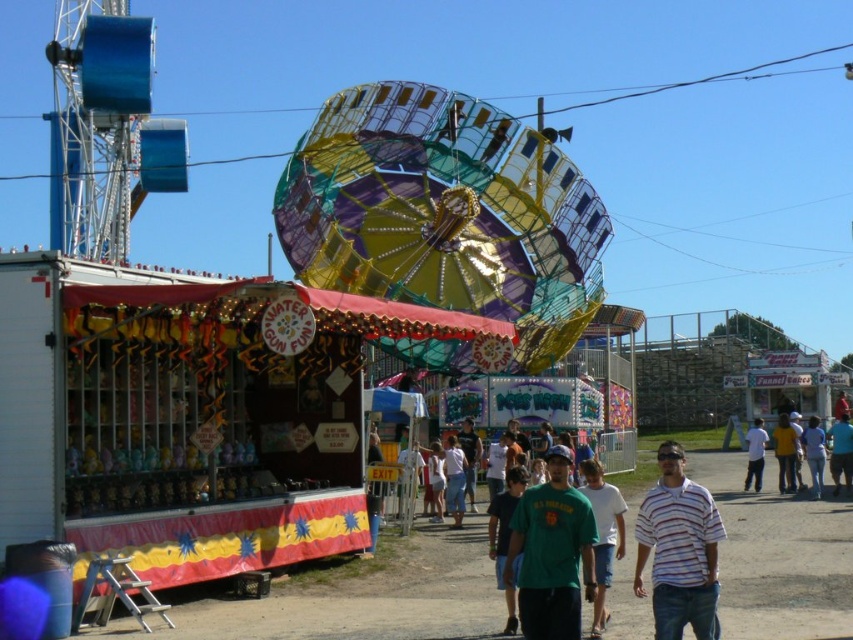
Is green cotton shirt at center further to the viewer compared to white cotton shirt at lower right?

That is False.

Is green cotton shirt at center taller than white cotton shirt at lower right?

Yes, green cotton shirt at center is taller than white cotton shirt at lower right.

Where is `green cotton shirt at center`? green cotton shirt at center is located at coordinates (602, 536).

You are a GUI agent. You are given a task and a screenshot of the screen. Output one action in this format:
    pyautogui.click(x=<x>, y=<y>)
    Task: Click on the green cotton shirt at center
    The height and width of the screenshot is (640, 853).
    Given the screenshot: What is the action you would take?
    pyautogui.click(x=602, y=536)

Who is more forward, (657, 566) or (572, 556)?

Point (572, 556) is in front.

What do you see at coordinates (679, 550) in the screenshot? Image resolution: width=853 pixels, height=640 pixels. I see `white striped shirt at lower right` at bounding box center [679, 550].

Where is `white striped shirt at lower right`? white striped shirt at lower right is located at coordinates (679, 550).

The image size is (853, 640). I want to click on white striped shirt at lower right, so click(679, 550).

Can you confirm if green matte shirt at center is smaller than blue fabric shirt at lower right?

Indeed, green matte shirt at center has a smaller size compared to blue fabric shirt at lower right.

Does green matte shirt at center have a greater height compared to blue fabric shirt at lower right?

Yes, green matte shirt at center is taller than blue fabric shirt at lower right.

Does point (502, 548) come behind point (839, 451)?

No, it is in front of (839, 451).

Identify the location of green matte shirt at center. The width and height of the screenshot is (853, 640). (505, 538).